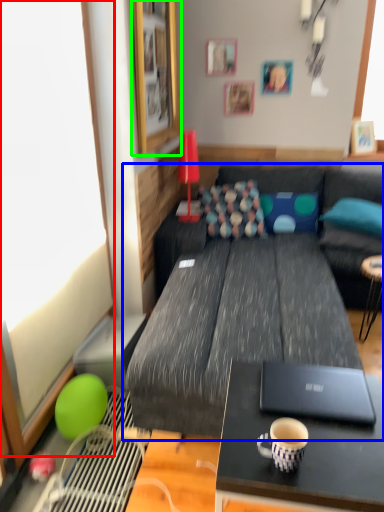
Question: Considering the real-world distances, which object is closest to window screen (highlighted by a red box)? studio couch (highlighted by a blue box) or picture frame (highlighted by a green box).

Choices:
 (A) studio couch
 (B) picture frame

Answer: (A)